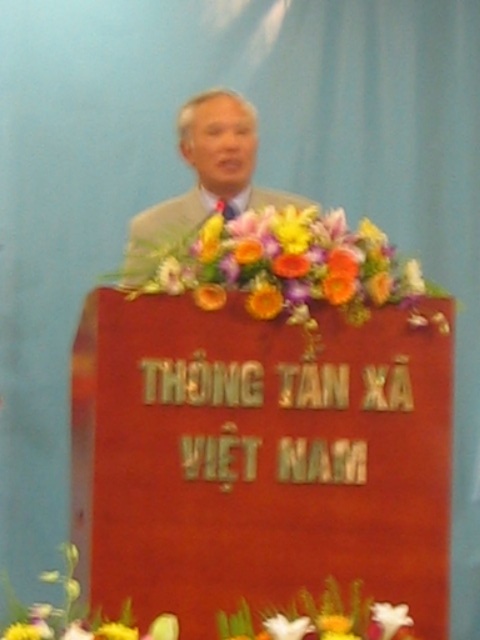
You are organizing a formal event and need to ensure that the light gray suit at center is visible to the audience. Given that the vibrant bouquet at center is in front of it, will the bouquet block the view of the suit?

The vibrant bouquet at center occupies less space than the light gray suit at center, so the bouquet will not completely block the view of the suit. However, part of the suit might be slightly obscured depending on the angle and positioning.

You are a photographer positioned at the center of the stage, facing the podium. You need to adjust your camera to focus on both the point at coordinates point (180, 404) and point (264, 292). Which point should you focus on first to ensure the closer one is sharp?

You should focus on point (180, 404) first because it is closer to you than point (264, 292), so adjusting focus starting from the closer point ensures proper sharpness for both.